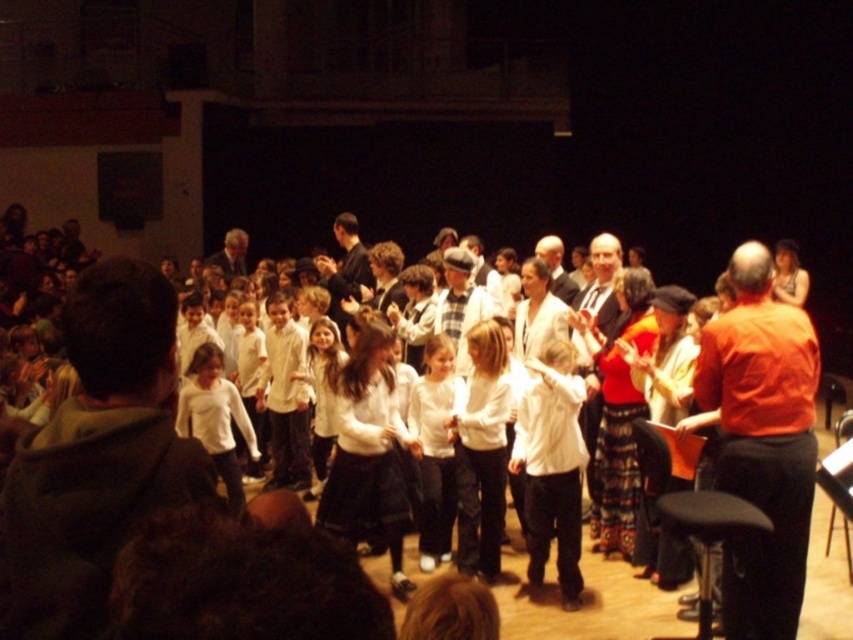
You are a photographer standing at the back of the theater. You want to take a photo that includes both the white textured sweater at center and the shiny gold necklace at upper center. Given that your camera has a maximum focus range of 3 meters, will you be able to capture both subjects clearly in the same frame?

The distance between the white textured sweater at center and the shiny gold necklace at upper center is 3.41 meters. Since the camera can only focus within 3 meters, the subjects are too far apart for both to be in clear focus simultaneously.

You are an audience member sitting in the balcony. You notice two items in the scene that stand out to you. One is the shiny gold necklace at upper center and the other is the white shirt at center. Which of these two items is bigger in size?

The shiny gold necklace at upper center is larger in size compared to the white shirt at center.